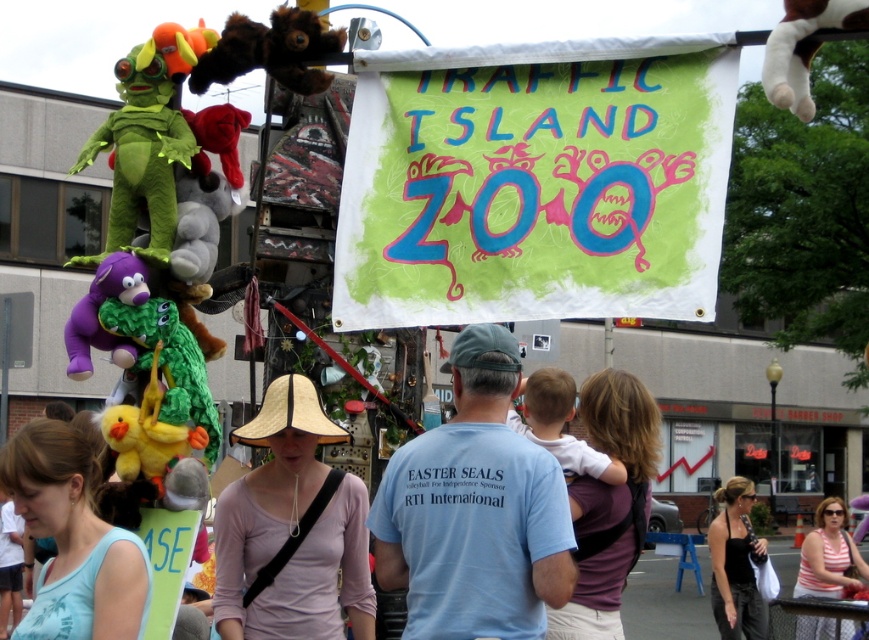
Consider the image. You are standing at the entrance of the Traffic Island Zoo booth and see two points marked on the banner. Which point is closer to you, point (277, 19) or point (800, 102)?

Point (277, 19) is closer to you because it is further to the viewer than point (800, 102).